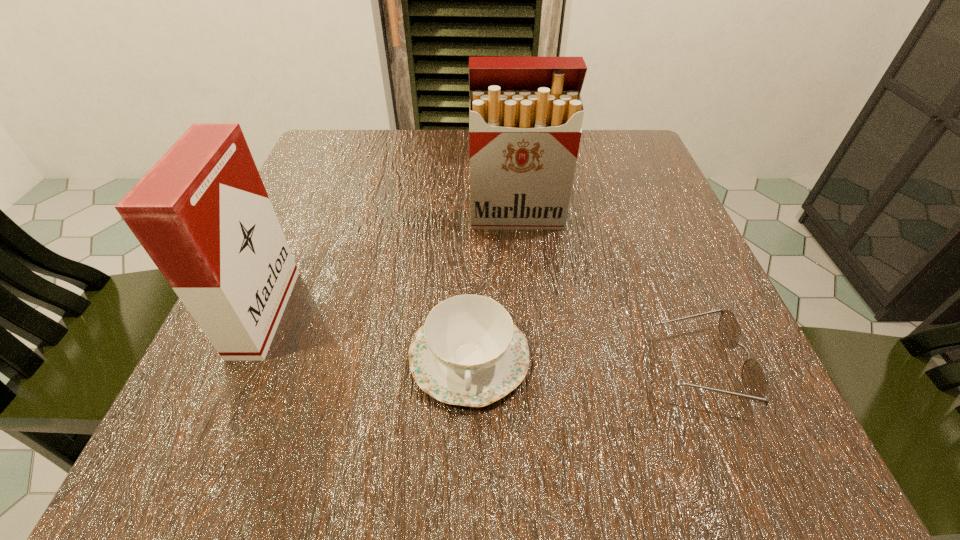
You are a GUI agent. You are given a task and a screenshot of the screen. Output one action in this format:
    pyautogui.click(x=<x>, y=<y>)
    Task: Click on the vacant point located 0.260m on the front-facing side of the shortest object
    
    Given the screenshot: What is the action you would take?
    pyautogui.click(x=467, y=365)

Where is `free space located 0.210m on the front-facing side of the shortest object`? This screenshot has width=960, height=540. free space located 0.210m on the front-facing side of the shortest object is located at coordinates (503, 365).

Find the location of a particular element. free region located 0.370m on the front-facing side of the shortest object is located at coordinates (385, 365).

You are a GUI agent. You are given a task and a screenshot of the screen. Output one action in this format:
    pyautogui.click(x=<x>, y=<y>)
    Task: Click on the chinaware that is positioned at the near edge
    
    Given the screenshot: What is the action you would take?
    pyautogui.click(x=469, y=352)

At what (x,y) coordinates should I click in order to perform the action: click on spectacles located in the near edge section of the desktop. Please return your answer as a coordinate pair (x, y). Looking at the image, I should click on (754, 379).

Image resolution: width=960 pixels, height=540 pixels. In order to click on object at the left edge in this screenshot , I will do `click(202, 213)`.

Locate an element on the screen. object that is at the right edge is located at coordinates (754, 379).

You are a GUI agent. You are given a task and a screenshot of the screen. Output one action in this format:
    pyautogui.click(x=<x>, y=<y>)
    Task: Click on the object that is at the near right corner
    
    Given the screenshot: What is the action you would take?
    pyautogui.click(x=754, y=379)

In the image, there is a desktop. Identify the location of free region at the far edge. Image resolution: width=960 pixels, height=540 pixels. (406, 170).

This screenshot has width=960, height=540. In the image, there is a desktop. What are the coordinates of `vacant space at the left edge` in the screenshot? It's located at (277, 330).